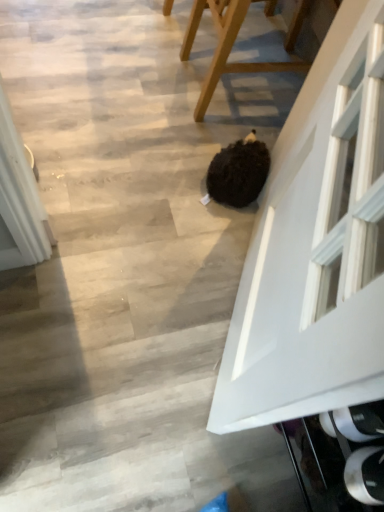
Question: In terms of height, does white glossy door at center look taller or shorter compared to wooden chair at center?

Choices:
 (A) short
 (B) tall

Answer: (B)

Question: Is point (312, 138) positioned closer to the camera than point (226, 10)?

Choices:
 (A) closer
 (B) farther

Answer: (A)

Question: Is white glossy door at center spatially inside wooden chair at center, or outside of it?

Choices:
 (A) outside
 (B) inside

Answer: (A)

Question: From a real-world perspective, is wooden chair at center physically located above or below white glossy door at center?

Choices:
 (A) above
 (B) below

Answer: (B)

Question: From the image's perspective, relative to white glossy door at center, is wooden chair at center above or below?

Choices:
 (A) above
 (B) below

Answer: (A)

Question: In terms of size, does wooden chair at center appear bigger or smaller than white glossy door at center?

Choices:
 (A) small
 (B) big

Answer: (B)

Question: Is wooden chair at center wider or thinner than white glossy door at center?

Choices:
 (A) wide
 (B) thin

Answer: (A)